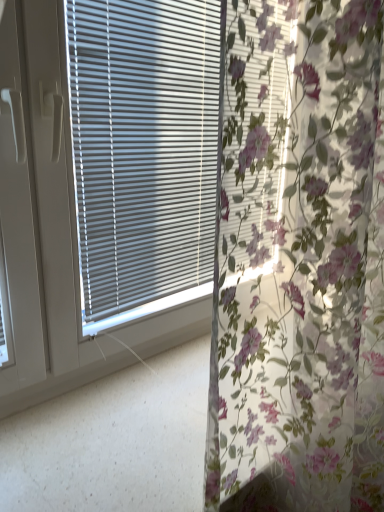
You are a GUI agent. You are given a task and a screenshot of the screen. Output one action in this format:
    pyautogui.click(x=<x>, y=<y>)
    Task: Click on the matte gray blinds at center
    This screenshot has height=512, width=384.
    Given the screenshot: What is the action you would take?
    pyautogui.click(x=143, y=147)

Measure the distance between matte gray blinds at center and camera.

matte gray blinds at center and camera are 78.52 centimeters apart.

What do you see at coordinates (143, 147) in the screenshot?
I see `matte gray blinds at center` at bounding box center [143, 147].

What do you see at coordinates (300, 264) in the screenshot? I see `floral fabric curtain at center` at bounding box center [300, 264].

Where is `floral fabric curtain at center`? floral fabric curtain at center is located at coordinates (300, 264).

Locate an element on the screen. matte gray blinds at center is located at coordinates (143, 147).

Based on their positions, is matte gray blinds at center located to the left or right of floral fabric curtain at center?

From the image, it's evident that matte gray blinds at center is to the left of floral fabric curtain at center.

Is matte gray blinds at center positioned before floral fabric curtain at center?

No, it is behind floral fabric curtain at center.

Considering the points (185, 109) and (299, 263), which point is in front, point (185, 109) or point (299, 263)?

Positioned in front is point (299, 263).

From the image's perspective, which object appears higher, matte gray blinds at center or floral fabric curtain at center?

matte gray blinds at center appears higher in the image.

From a real-world perspective, does matte gray blinds at center sit lower than floral fabric curtain at center?

No, from a real-world perspective, matte gray blinds at center is not beneath floral fabric curtain at center.

Can you confirm if matte gray blinds at center is wider than floral fabric curtain at center?

In fact, matte gray blinds at center might be narrower than floral fabric curtain at center.

Who is taller, matte gray blinds at center or floral fabric curtain at center?

floral fabric curtain at center is taller.

Does matte gray blinds at center have a smaller size compared to floral fabric curtain at center?

Correct, matte gray blinds at center occupies less space than floral fabric curtain at center.

Which is correct: matte gray blinds at center is inside floral fabric curtain at center, or outside of it?

matte gray blinds at center exists outside the volume of floral fabric curtain at center.

Would you say matte gray blinds at center is a long distance from floral fabric curtain at center?

Actually, matte gray blinds at center and floral fabric curtain at center are a little close together.

Could you tell me if matte gray blinds at center is turned towards floral fabric curtain at center?

Yes, matte gray blinds at center is facing floral fabric curtain at center.

At what (x,y) coordinates should I click in order to perform the action: click on curtain in front of the matte gray blinds at center. Please return your answer as a coordinate pair (x, y). The height and width of the screenshot is (512, 384). Looking at the image, I should click on (300, 264).

Can you confirm if floral fabric curtain at center is positioned to the right of matte gray blinds at center?

Yes, floral fabric curtain at center is to the right of matte gray blinds at center.

Relative to matte gray blinds at center, is floral fabric curtain at center in front or behind?

Visually, floral fabric curtain at center is located in front of matte gray blinds at center.

Considering the points (232, 198) and (140, 203), which point is in front, point (232, 198) or point (140, 203)?

The point (232, 198) is more forward.

In the scene shown: From the image's perspective, which is above, floral fabric curtain at center or matte gray blinds at center?

matte gray blinds at center is shown above in the image.

From a real-world perspective, is floral fabric curtain at center on top of matte gray blinds at center?

No.

Does floral fabric curtain at center have a greater width compared to matte gray blinds at center?

Correct, the width of floral fabric curtain at center exceeds that of matte gray blinds at center.

Who is taller, floral fabric curtain at center or matte gray blinds at center?

floral fabric curtain at center.

Based on their sizes in the image, would you say floral fabric curtain at center is bigger or smaller than matte gray blinds at center?

Considering their sizes, floral fabric curtain at center takes up more space than matte gray blinds at center.

Is floral fabric curtain at center surrounding matte gray blinds at center?

Definitely not — matte gray blinds at center is not inside floral fabric curtain at center.

Is floral fabric curtain at center not close to matte gray blinds at center?

No.

Is floral fabric curtain at center facing towards matte gray blinds at center?

No, floral fabric curtain at center is not facing towards matte gray blinds at center.

You are a GUI agent. You are given a task and a screenshot of the screen. Output one action in this format:
    pyautogui.click(x=<x>, y=<y>)
    Task: Click on the window blind above the floral fabric curtain at center (from a real-world perspective)
    The width and height of the screenshot is (384, 512).
    Given the screenshot: What is the action you would take?
    pyautogui.click(x=143, y=147)

The image size is (384, 512). What are the coordinates of `curtain below the matte gray blinds at center (from the image's perspective)` in the screenshot? It's located at (300, 264).

Find the location of a particular element. This screenshot has width=384, height=512. window blind on the left of floral fabric curtain at center is located at coordinates (143, 147).